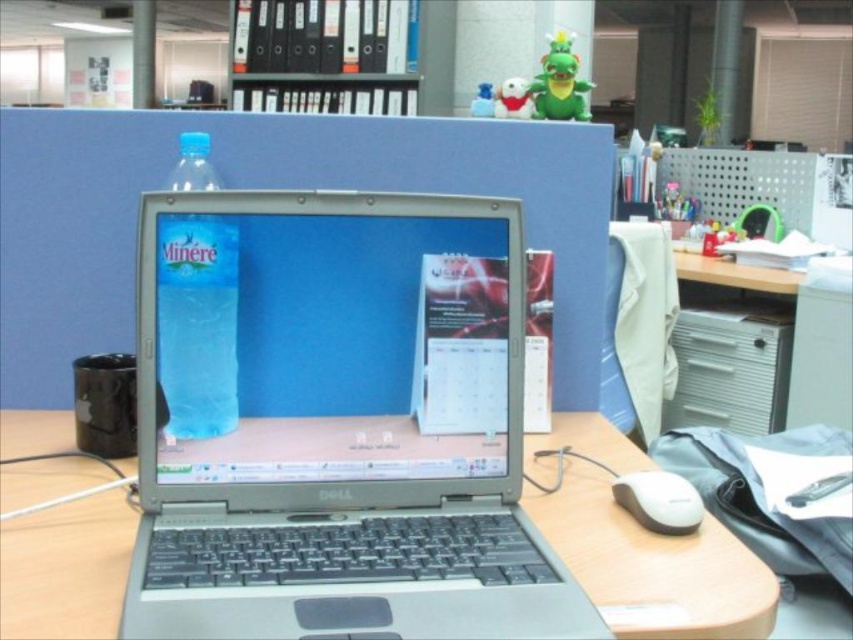
Is the position of wooden desk at center less distant than that of white matte mouse at lower right?

Yes, wooden desk at center is in front of white matte mouse at lower right.

Describe the element at coordinates (653, 564) in the screenshot. I see `wooden desk at center` at that location.

Which is in front, point (531, 452) or point (625, 493)?

Point (625, 493) is in front.

Locate an element on the screen. wooden desk at center is located at coordinates (653, 564).

Looking at this image, which is more to the left, silver metallic laptop at center or blue plastic bottle at center?

From the viewer's perspective, blue plastic bottle at center appears more on the left side.

Which of these two, silver metallic laptop at center or blue plastic bottle at center, stands taller?

With more height is silver metallic laptop at center.

Who is more distant from viewer, (518,561) or (216,228)?

The point (216,228) is more distant.

This screenshot has height=640, width=853. Find the location of `silver metallic laptop at center`. silver metallic laptop at center is located at coordinates (335, 422).

Does wooden desk at center have a smaller size compared to blue plastic bottle at center?

Yes, wooden desk at center is smaller than blue plastic bottle at center.

Looking at this image, is wooden desk at center shorter than blue plastic bottle at center?

Indeed, wooden desk at center has a lesser height compared to blue plastic bottle at center.

Identify the location of wooden desk at center. (653, 564).

You are a GUI agent. You are given a task and a screenshot of the screen. Output one action in this format:
    pyautogui.click(x=<x>, y=<y>)
    Task: Click on the wooden desk at center
    The height and width of the screenshot is (640, 853).
    Given the screenshot: What is the action you would take?
    pyautogui.click(x=653, y=564)